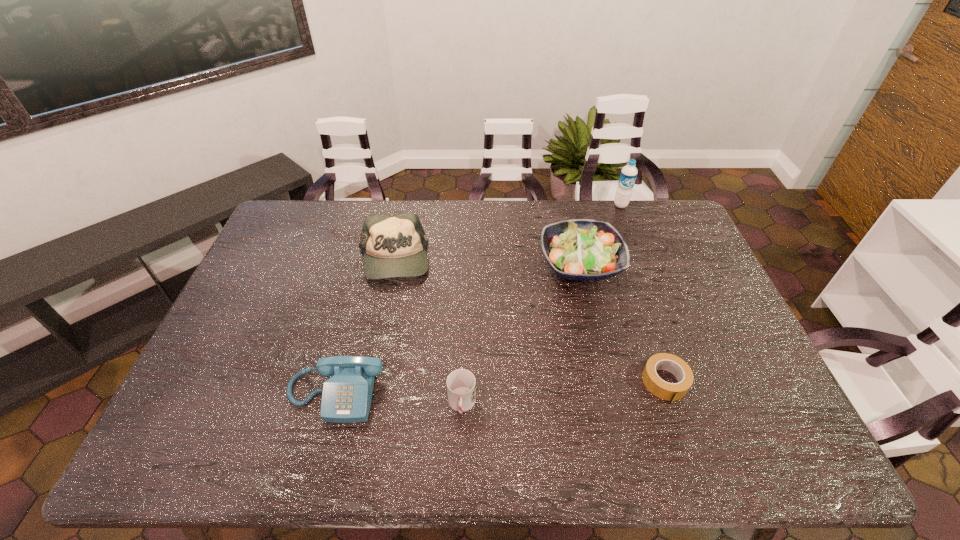
This screenshot has height=540, width=960. I want to click on the second closest object to the shortest object, so click(x=461, y=388).

Locate which object is the closest to the baseball cap. Please provide its 2D coordinates. Your answer should be formatted as a tuple, i.e. [(x, y)], where the tuple contains the x and y coordinates of a point satisfying the conditions above.

[(346, 397)]